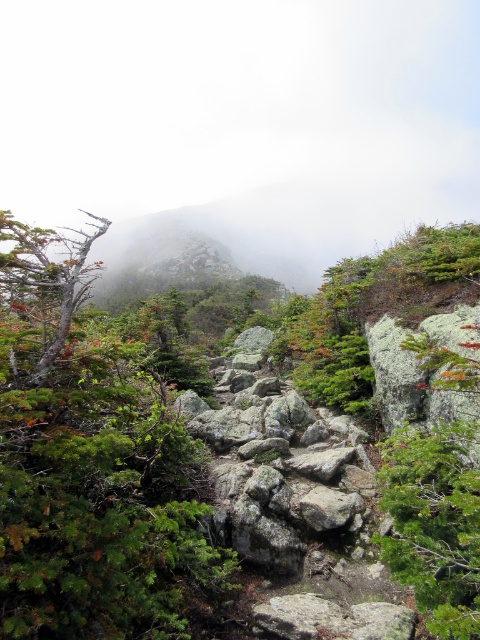
Between green matte tree at left and smooth gray tree at left, which one appears on the right side from the viewer's perspective?

Positioned to the right is green matte tree at left.

Can you confirm if green matte tree at left is taller than smooth gray tree at left?

No.

Is point (54, 426) in front of point (37, 326)?

Yes, point (54, 426) is in front of point (37, 326).

I want to click on green matte tree at left, so click(87, 464).